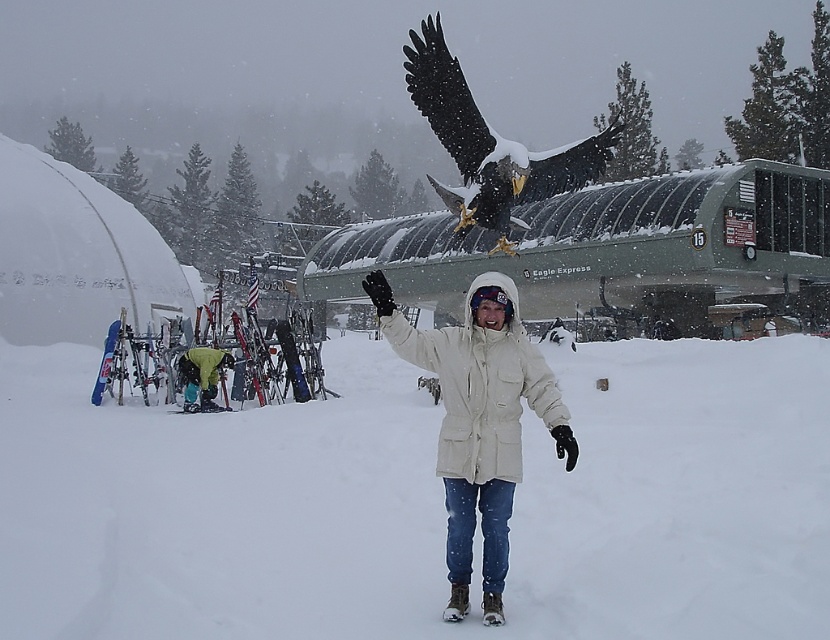
You are a winter sports instructor preparing to demonstrate a safety check for equipment. You have a white matte glove at center and transparent plastic goggles at center. The safety manual requires that these two items must be within 24 inches of each other for easy access during the demonstration. Based on the scene description, are they positioned correctly?

The white matte glove at center is 24.59 inches away from transparent plastic goggles at center. Since 24.59 inches exceeds the 24 inch requirement, the items are not positioned correctly for easy access during the demonstration.

You are navigating a drone through the snowy ski resort scene. You need to fly from point A at coordinates point (399,356) to point B at coordinates point (474,301). Considering the spatial relationship between these two points, which direction should you fly the drone to move from point A to point B?

To move from point A at coordinates point (399,356) to point B at coordinates point (474,301), you should fly the drone towards the upper left direction since point A is behind point B, meaning point B is in front of point A.